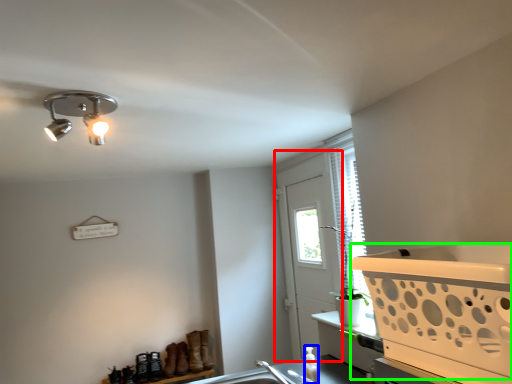
Question: Considering the real-world distances, which object is closest to screen door (highlighted by a red box)? bottle (highlighted by a blue box) or basket (highlighted by a green box).

Choices:
 (A) bottle
 (B) basket

Answer: (A)